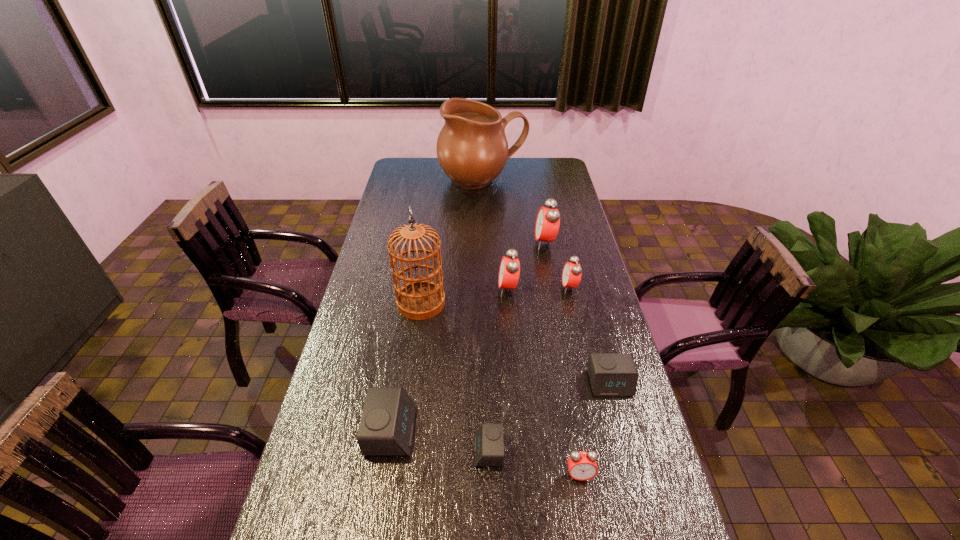
At what (x,y) coordinates should I click in order to perform the action: click on the biggest black alarm clock. Please return your answer as a coordinate pair (x, y). The width and height of the screenshot is (960, 540). Looking at the image, I should click on point(386,428).

Find the location of a particular element. The image size is (960, 540). the nearest red alarm clock is located at coordinates (582, 466).

Identify the location of the fourth nearest alarm clock. (611, 374).

Locate an element on the screen. The image size is (960, 540). the sixth farthest object is located at coordinates (611, 374).

Locate an element on the screen. The height and width of the screenshot is (540, 960). the second black alarm clock from left to right is located at coordinates (489, 446).

The width and height of the screenshot is (960, 540). Identify the location of the shortest object. [489, 446].

The width and height of the screenshot is (960, 540). Find the location of `free region located at the spout of the brown cream pitcher`. free region located at the spout of the brown cream pitcher is located at coordinates (483, 211).

Find the location of a particular element. The image size is (960, 540). vacant space situated 0.220m on the back of the birdcage is located at coordinates (429, 249).

This screenshot has height=540, width=960. In order to click on vacant space positioned 0.280m on the front-facing side of the seventh shortest object in this screenshot , I will do `click(466, 243)`.

The width and height of the screenshot is (960, 540). Identify the location of free space located on the front-facing side of the seventh shortest object. click(x=459, y=243).